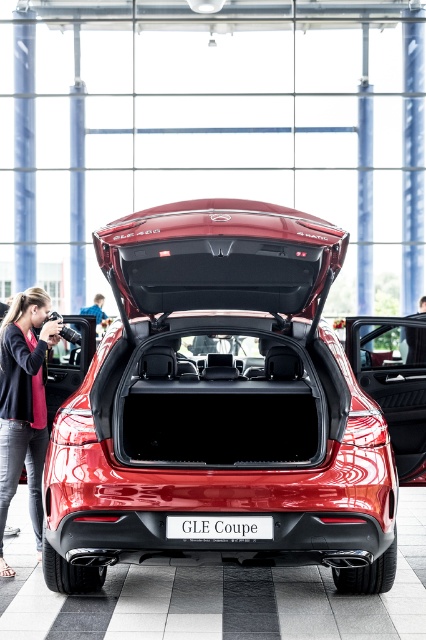
You are standing in front of the red Mercedes GLE Coupe in the showroom. There are two points marked on the car, one at coordinate point (417, 484) and the other at point (219, 518). Which point is closer to you?

Point (417, 484) is closer to you because it is further to the viewer than point (219, 518).

You are a delivery person with a package that requires a secure spot to place it temporarily. You see the pink fabric jacket at lower left and the white plastic license plate at center. Can you place the package between them?

The pink fabric jacket at lower left is 1.76 meters away from the white plastic license plate at center, so yes, the package can be placed between them as there is sufficient space.

You are a delivery person holding a large package that needs to be placed in the trunk of the glossy metallic car at center. The pink fabric jacket at lower left belongs to a customer waiting nearby. Can you safely place the package in the trunk without disturbing the jacket?

The pink fabric jacket at lower left and glossy metallic car at center are 8.86 feet apart, so yes, you can safely place the package in the trunk of the glossy metallic car at center without disturbing the jacket since they are sufficiently far apart.